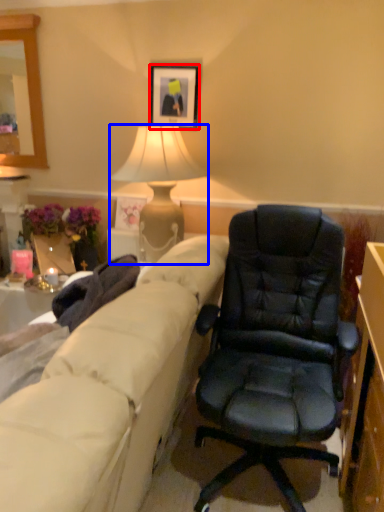
Question: Which point is further to the camera, picture frame (highlighted by a red box) or lamp (highlighted by a blue box)?

Choices:
 (A) picture frame
 (B) lamp

Answer: (A)